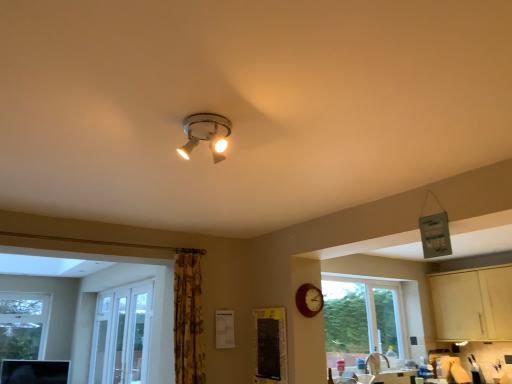
Question: Is black fabric bulletin board at lower center directly adjacent to light wood cabinet at lower right?

Choices:
 (A) yes
 (B) no

Answer: (B)

Question: Can you confirm if black fabric bulletin board at lower center is wider than light wood cabinet at lower right?

Choices:
 (A) no
 (B) yes

Answer: (A)

Question: Is black fabric bulletin board at lower center oriented away from light wood cabinet at lower right?

Choices:
 (A) no
 (B) yes

Answer: (B)

Question: From a real-world perspective, does black fabric bulletin board at lower center sit lower than light wood cabinet at lower right?

Choices:
 (A) no
 (B) yes

Answer: (B)

Question: Does black fabric bulletin board at lower center have a lesser width compared to light wood cabinet at lower right?

Choices:
 (A) yes
 (B) no

Answer: (A)

Question: Does black fabric bulletin board at lower center have a greater height compared to light wood cabinet at lower right?

Choices:
 (A) no
 (B) yes

Answer: (A)

Question: Can you confirm if matte silver spotlight at upper center is taller than light wood cabinet at lower right?

Choices:
 (A) yes
 (B) no

Answer: (B)

Question: From the image's perspective, is matte silver spotlight at upper center on top of light wood cabinet at lower right?

Choices:
 (A) no
 (B) yes

Answer: (B)

Question: Can you confirm if matte silver spotlight at upper center is bigger than light wood cabinet at lower right?

Choices:
 (A) no
 (B) yes

Answer: (A)

Question: Is matte silver spotlight at upper center located outside light wood cabinet at lower right?

Choices:
 (A) yes
 (B) no

Answer: (A)

Question: Does matte silver spotlight at upper center have a greater width compared to light wood cabinet at lower right?

Choices:
 (A) no
 (B) yes

Answer: (A)

Question: Is matte silver spotlight at upper center positioned before light wood cabinet at lower right?

Choices:
 (A) no
 (B) yes

Answer: (B)

Question: Is yellow floral fabric curtain at center-left not close to wooden clock at lower right?

Choices:
 (A) no
 (B) yes

Answer: (A)